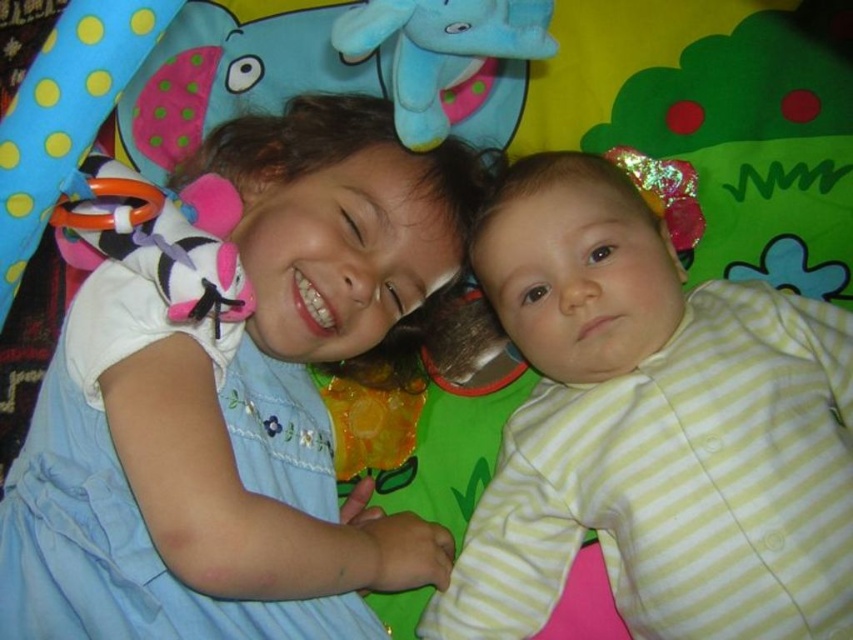
Question: Among these objects, which one is nearest to the camera?

Choices:
 (A) matte blue dress at upper left
 (B) blue plush elephant at upper center

Answer: (A)

Question: Can you confirm if matte blue dress at upper left is positioned to the left of yellow striped fabric at upper right?

Choices:
 (A) no
 (B) yes

Answer: (B)

Question: From the image, what is the correct spatial relationship of yellow striped fabric at upper right in relation to blue plush elephant at upper center?

Choices:
 (A) left
 (B) right

Answer: (B)

Question: Is yellow striped fabric at upper right above blue plush elephant at upper center?

Choices:
 (A) yes
 (B) no

Answer: (B)

Question: Which of the following is the farthest from the observer?

Choices:
 (A) blue plush elephant at upper center
 (B) matte blue dress at upper left
 (C) yellow striped fabric at upper right

Answer: (C)

Question: Which point is closer to the camera?

Choices:
 (A) yellow striped fabric at upper right
 (B) blue plush elephant at upper center

Answer: (B)